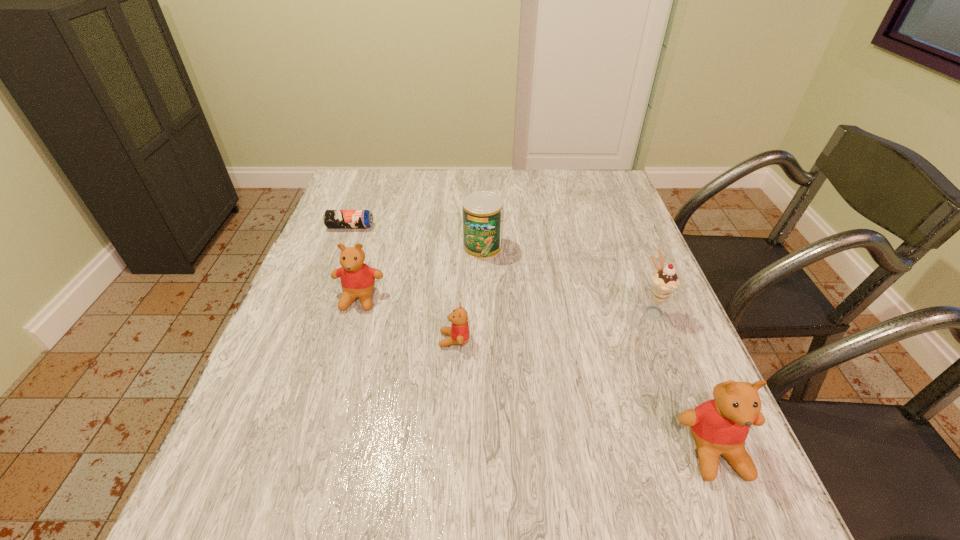
Identify the location of vacant area situated 0.280m on the front-facing side of the second shortest teddy bear. The height and width of the screenshot is (540, 960). (324, 423).

Identify the location of free space located on the front-facing side of the shortest teddy bear. Image resolution: width=960 pixels, height=540 pixels. (335, 340).

Locate an element on the screen. The image size is (960, 540). vacant space located on the front-facing side of the shortest teddy bear is located at coordinates (398, 340).

The height and width of the screenshot is (540, 960). Find the location of `blank area located on the front-facing side of the shortest teddy bear`. blank area located on the front-facing side of the shortest teddy bear is located at coordinates (321, 340).

Identify the location of vacant space situated 0.230m on the front of the second farthest object. (483, 323).

Image resolution: width=960 pixels, height=540 pixels. What are the coordinates of `vacant position located on the front of the farthest object` in the screenshot? It's located at (340, 254).

Identify the location of vacant space located 0.320m on the back of the icecream. The height and width of the screenshot is (540, 960). (617, 222).

Identify the location of object present at the near edge. (720, 426).

The image size is (960, 540). In order to click on teddy bear that is at the left edge in this screenshot , I will do `click(357, 279)`.

Find the location of a particular element. This screenshot has height=540, width=960. beer can located in the left edge section of the desktop is located at coordinates (332, 218).